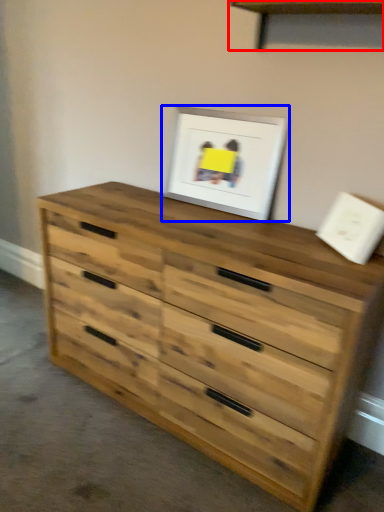
Question: Which object appears closest to the camera in this image, shelf (highlighted by a red box) or picture frame (highlighted by a blue box)?

Choices:
 (A) shelf
 (B) picture frame

Answer: (A)